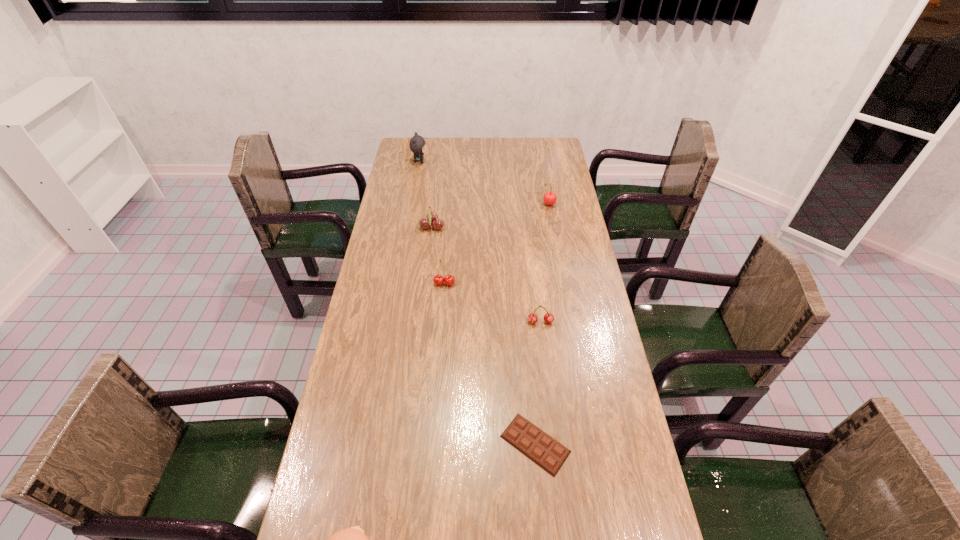
Where is `object that stands as the sixth closest to the second shortest object`? This screenshot has height=540, width=960. object that stands as the sixth closest to the second shortest object is located at coordinates (417, 144).

Identify which object is located as the fourth nearest to the fourth farthest object. Please provide its 2D coordinates. Your answer should be formatted as a tuple, i.e. [(x, y)], where the tuple contains the x and y coordinates of a point satisfying the conditions above.

[(549, 198)]

Identify which cherry is the second nearest to the farthest object. Please provide its 2D coordinates. Your answer should be formatted as a tuple, i.e. [(x, y)], where the tuple contains the x and y coordinates of a point satisfying the conditions above.

[(549, 198)]

You are a GUI agent. You are given a task and a screenshot of the screen. Output one action in this format:
    pyautogui.click(x=<x>, y=<y>)
    Task: Click on the cherry that is the closest one to the fourth nearest object
    This screenshot has height=540, width=960.
    Given the screenshot: What is the action you would take?
    pyautogui.click(x=431, y=217)

Locate an element on the screen. vacant space that satisfies the following two spatial constraints: 1. on the front-facing side of the sixth farthest object; 2. on the right side of the farthest object is located at coordinates (370, 444).

Where is `vacant space that satisfies the following two spatial constraints: 1. on the front-facing side of the farthest object; 2. on the back side of the farthest cherry`? This screenshot has width=960, height=540. vacant space that satisfies the following two spatial constraints: 1. on the front-facing side of the farthest object; 2. on the back side of the farthest cherry is located at coordinates 412,205.

I want to click on free region that satisfies the following two spatial constraints: 1. on the leaves of the fifth nearest object; 2. on the left side of the shortest object, so click(x=407, y=444).

Find the location of a particular element. The image size is (960, 540). vacant area that satisfies the following two spatial constraints: 1. on the front-facing side of the kitten; 2. on the left side of the shortest object is located at coordinates (370, 444).